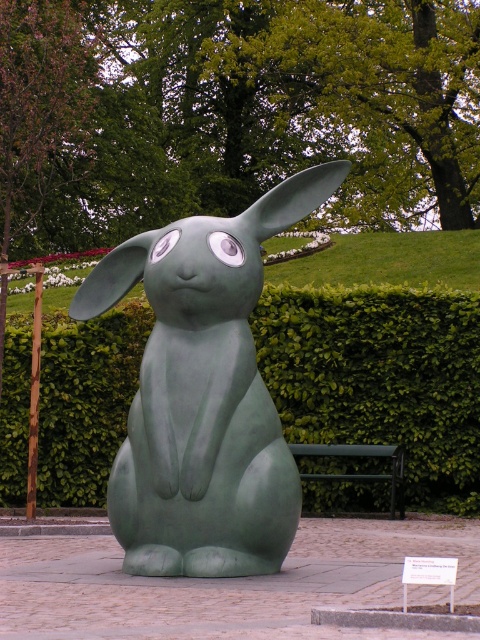
Question: Which point is farther to the camera?

Choices:
 (A) (233, 349)
 (B) (311, 454)

Answer: (B)

Question: Does green leafy hedge at center have a lesser width compared to green matte rabbit at center?

Choices:
 (A) yes
 (B) no

Answer: (A)

Question: Does green matte rabbit at center appear on the left side of green metal bench at center?

Choices:
 (A) yes
 (B) no

Answer: (A)

Question: Which is nearer to the green matte rabbit at center?

Choices:
 (A) green metal bench at center
 (B) green leafy hedge at center

Answer: (A)

Question: Which of the following is the farthest from the observer?

Choices:
 (A) green metal bench at center
 (B) green leafy hedge at center

Answer: (B)

Question: Is green matte rabbit at center closer to the viewer compared to green metal bench at center?

Choices:
 (A) no
 (B) yes

Answer: (B)